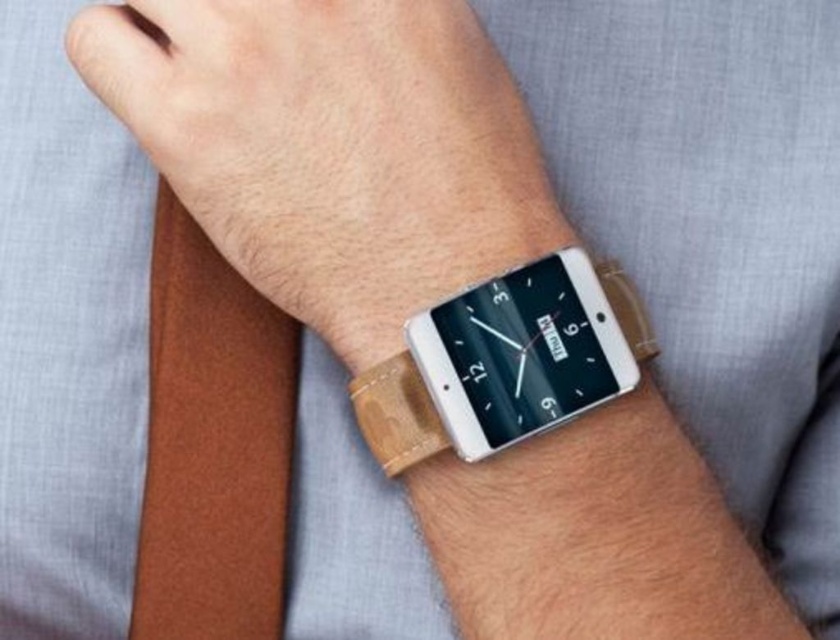
Question: In this image, where is wooden watch at center located relative to wooden at center?

Choices:
 (A) left
 (B) right

Answer: (B)

Question: Can you confirm if leather strap at wrist is smaller than wooden at center?

Choices:
 (A) no
 (B) yes

Answer: (A)

Question: Is brown leather tie at left above wooden at center?

Choices:
 (A) no
 (B) yes

Answer: (A)

Question: Which point is farther to the camera?

Choices:
 (A) wooden at center
 (B) leather watch at center

Answer: (B)

Question: Which of the following is the closest to the observer?

Choices:
 (A) leather strap at wrist
 (B) leather watch at center
 (C) brown leather tie at left
 (D) wooden watch at center

Answer: (D)

Question: Which of these objects is positioned farthest from the leather watch at center?

Choices:
 (A) brown leather tie at left
 (B) wooden at center
 (C) leather strap at wrist

Answer: (C)